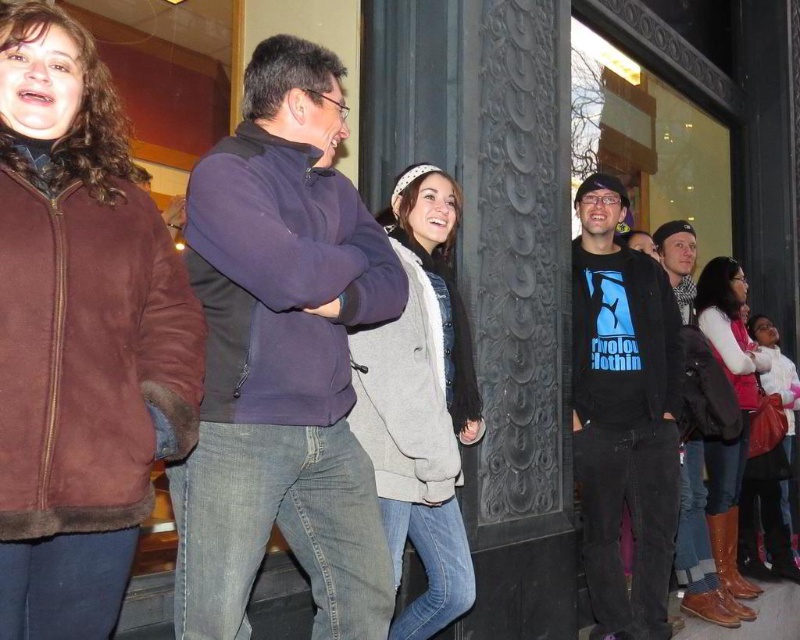
From the picture: You are standing at the point marked by the coordinates point (282,358) in the image. What object is located at this position?

The point (282,358) corresponds to the dark blue fleece at center.